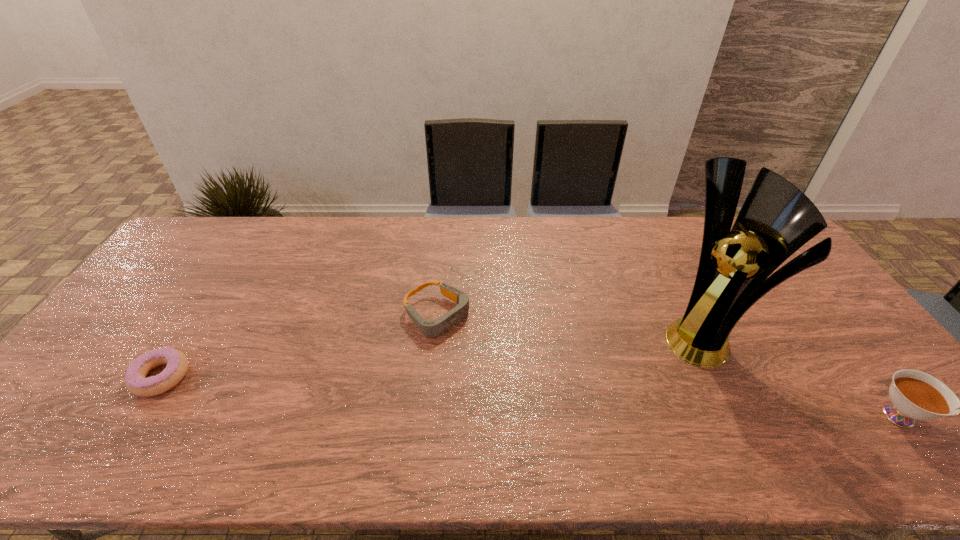
Where is `free space at the right edge`? The width and height of the screenshot is (960, 540). free space at the right edge is located at coordinates (802, 291).

Identify the location of unoccupied position between the third object from left to right and the rightmost object. (804, 376).

At what (x,y) coordinates should I click in order to perform the action: click on empty space between the doughnut and the third object from right to left. Please return your answer as a coordinate pair (x, y). The height and width of the screenshot is (540, 960). Looking at the image, I should click on (300, 345).

Where is `unoccupied position between the goggles and the award`? This screenshot has width=960, height=540. unoccupied position between the goggles and the award is located at coordinates (571, 326).

Locate an element on the screen. unoccupied position between the second tallest object and the award is located at coordinates (804, 376).

Identify the location of free spot between the rightmost object and the goggles. (669, 365).

Locate an element on the screen. empty space between the rightmost object and the award is located at coordinates (804, 376).

Where is `free space between the third shortest object and the goggles`? This screenshot has height=540, width=960. free space between the third shortest object and the goggles is located at coordinates (669, 365).

The width and height of the screenshot is (960, 540). I want to click on vacant area between the third object from right to left and the doughnut, so point(300,345).

Locate an element on the screen. The height and width of the screenshot is (540, 960). free space between the rightmost object and the second object from left to right is located at coordinates (669, 365).